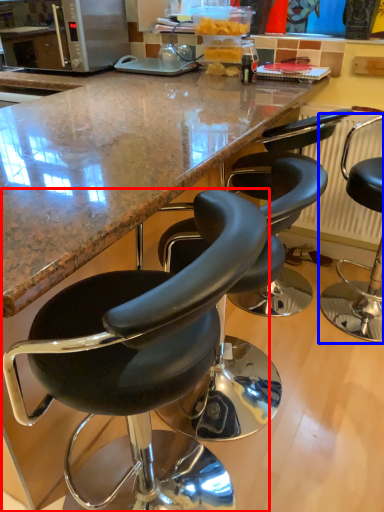
Question: Which point is closer to the camera, chair (highlighted by a red box) or chair (highlighted by a blue box)?

Choices:
 (A) chair
 (B) chair

Answer: (A)